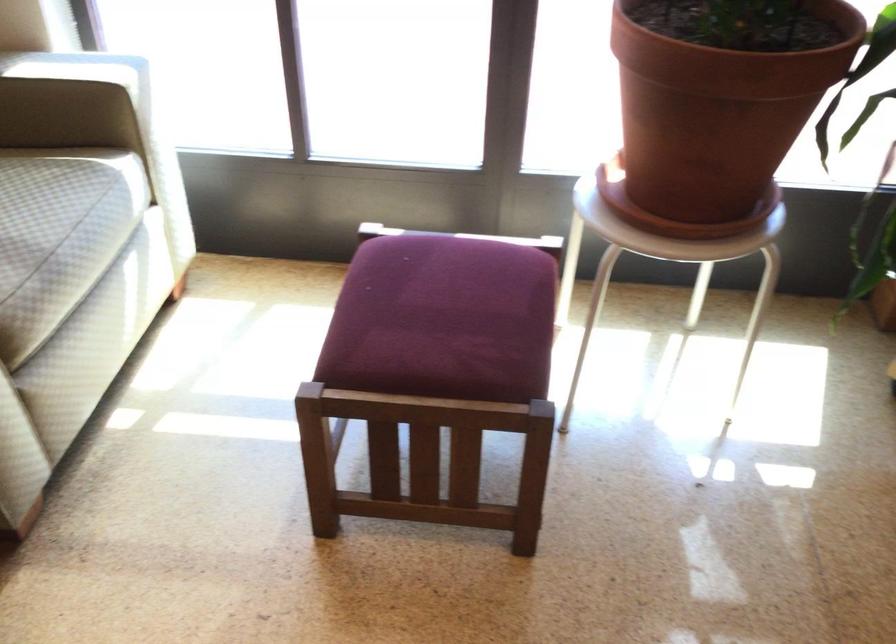
Where is `white metal stool`? The image size is (896, 644). white metal stool is located at coordinates (661, 272).